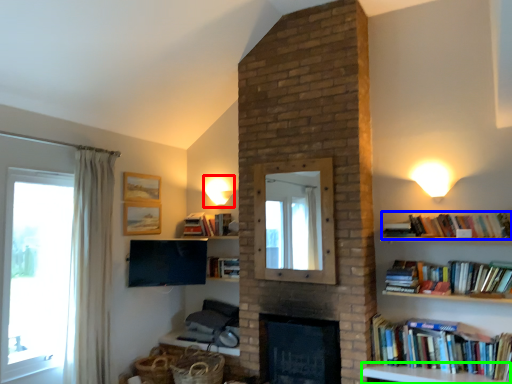
Question: Which is farther away from light fixture (highlighted by a red box)? book (highlighted by a blue box) or furniture (highlighted by a green box)?

Choices:
 (A) book
 (B) furniture

Answer: (B)